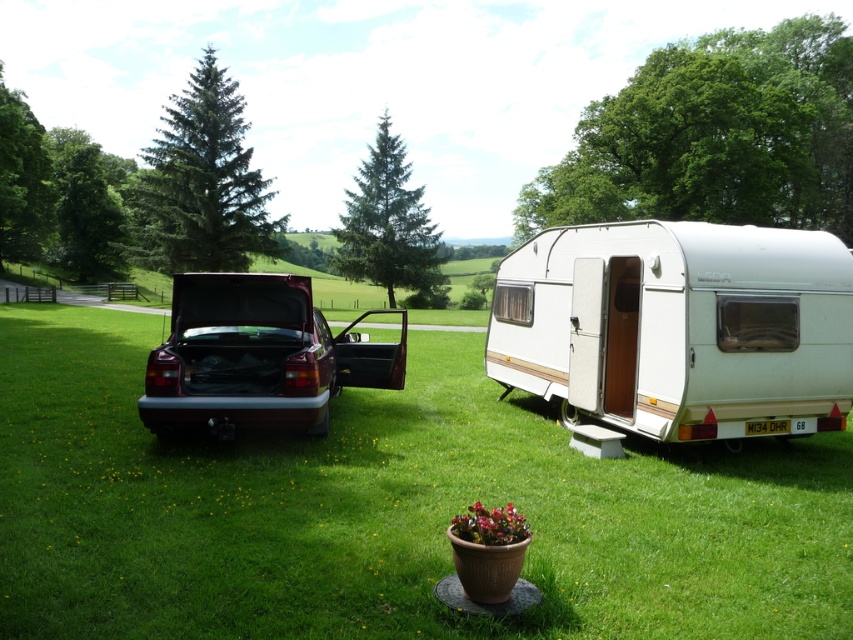
You are standing in the campsite and want to walk from the maroon metallic car at center to the green grass at center. Which direction should you move relative to the car?

You should move to the right relative to the maroon metallic car at center because the green grass at center is located to the right of the car.

You are planning to drive through the narrow path between the white plastic trailer at right and the maroon metallic car at center. Considering their widths, which vehicle should you avoid to ensure enough space?

The white plastic trailer at right is thinner than the maroon metallic car at center, so you should avoid the maroon metallic car at center to ensure enough space for the narrow path.